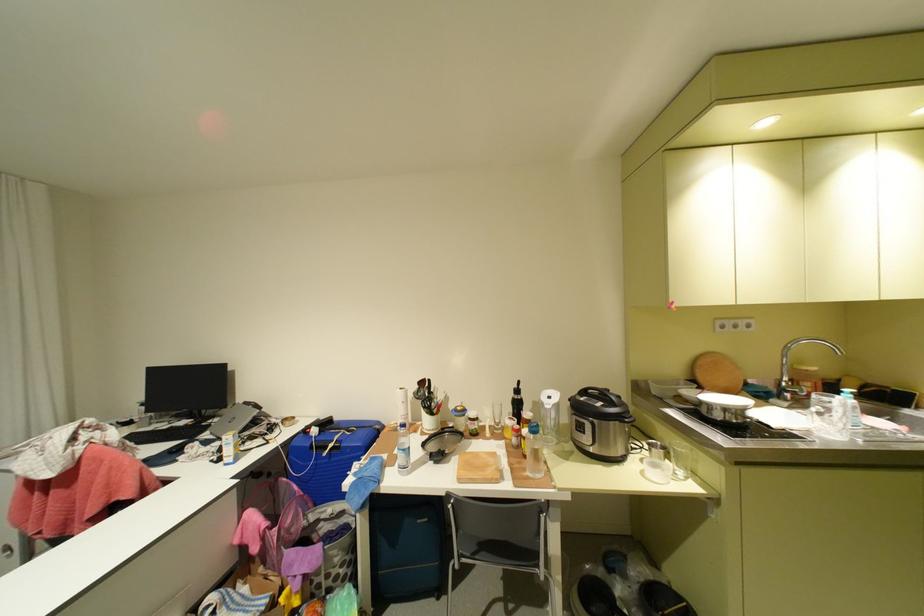
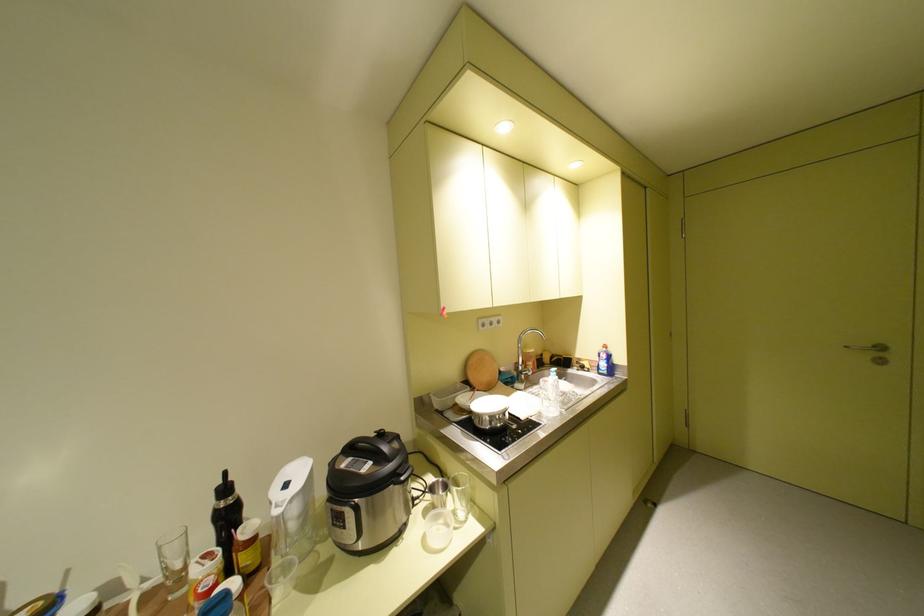
Locate, in the second image, the point that corresponds to (x=667, y=444) in the first image.

(450, 482)